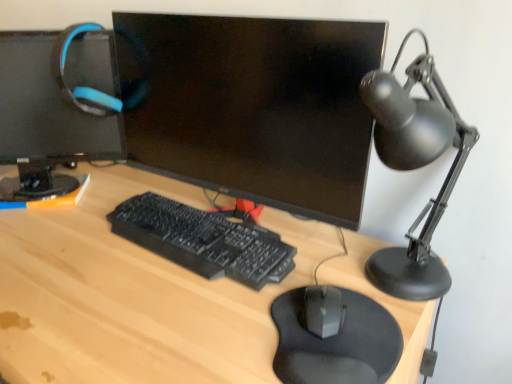
Question: Does light wood desk at center have a greater width compared to black matte mouse at center?

Choices:
 (A) no
 (B) yes

Answer: (B)

Question: Does light wood desk at center turn towards black matte mouse at center?

Choices:
 (A) no
 (B) yes

Answer: (A)

Question: Is light wood desk at center positioned with its back to black matte mouse at center?

Choices:
 (A) no
 (B) yes

Answer: (A)

Question: Does light wood desk at center have a greater height compared to black matte mouse at center?

Choices:
 (A) yes
 (B) no

Answer: (A)

Question: Does light wood desk at center have a lesser height compared to black matte mouse at center?

Choices:
 (A) yes
 (B) no

Answer: (B)

Question: Is light wood desk at center behind black matte mouse at center?

Choices:
 (A) no
 (B) yes

Answer: (A)

Question: From the image's perspective, is black plastic keyboard at center on black matte mousepad at lower center?

Choices:
 (A) yes
 (B) no

Answer: (A)

Question: From the image's perspective, would you say black plastic keyboard at center is shown under black matte mousepad at lower center?

Choices:
 (A) yes
 (B) no

Answer: (B)

Question: Could you tell me if black plastic keyboard at center is turned towards black matte mousepad at lower center?

Choices:
 (A) no
 (B) yes

Answer: (A)

Question: Considering the relative positions of black plastic keyboard at center and black matte mousepad at lower center in the image provided, is black plastic keyboard at center to the left of black matte mousepad at lower center from the viewer's perspective?

Choices:
 (A) yes
 (B) no

Answer: (A)

Question: Is black plastic keyboard at center facing away from black matte mousepad at lower center?

Choices:
 (A) yes
 (B) no

Answer: (B)

Question: Can you confirm if black plastic keyboard at center is taller than black matte mousepad at lower center?

Choices:
 (A) no
 (B) yes

Answer: (B)

Question: Is light wood desk at center facing away from matte black monitor at center, acting as the 2th computer monitor starting from the left?

Choices:
 (A) yes
 (B) no

Answer: (B)